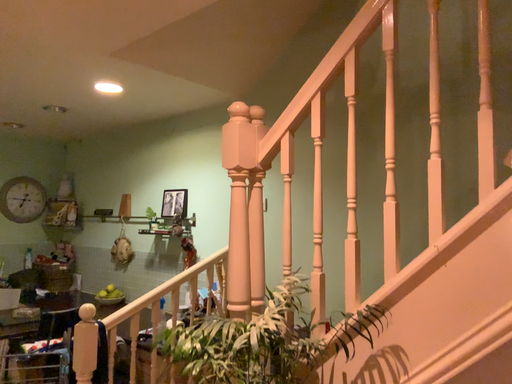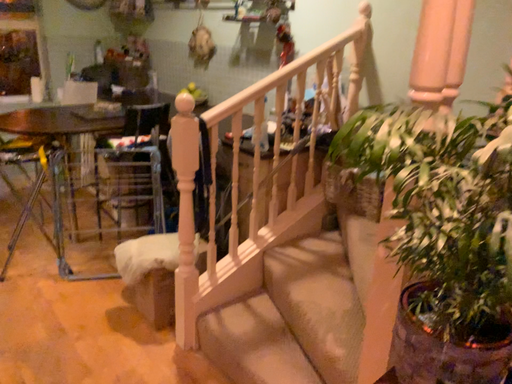
Question: How did the camera likely rotate when shooting the video?

Choices:
 (A) rotated left
 (B) rotated right

Answer: (A)